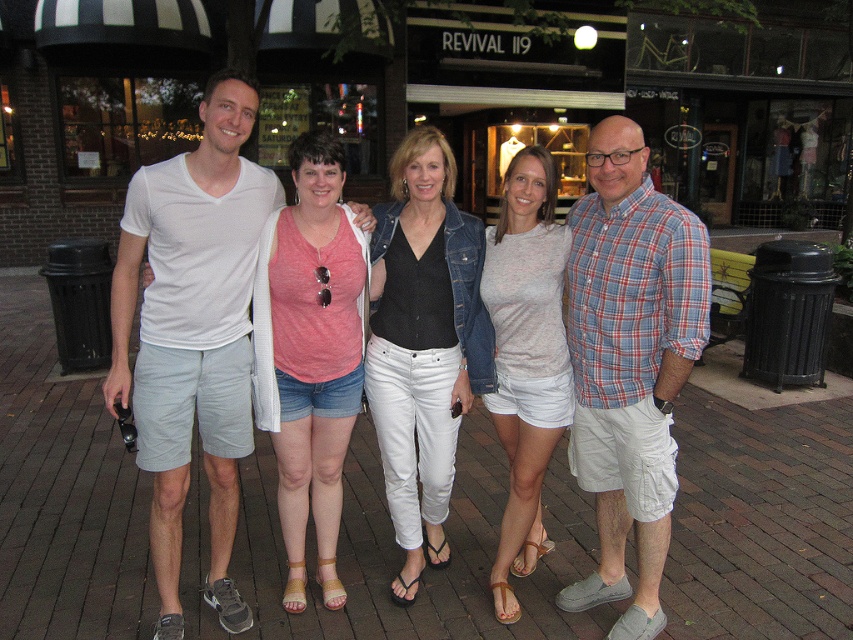
Can you confirm if white cotton shorts at center is shorter than pink fabric tank top at center?

No, white cotton shorts at center is not shorter than pink fabric tank top at center.

The height and width of the screenshot is (640, 853). I want to click on white cotton shorts at center, so click(x=434, y=266).

Does point (270, 204) come in front of point (454, 348)?

Yes, point (270, 204) is in front of point (454, 348).

Between point (190, 346) and point (227, 72), which one is positioned behind?

Positioned behind is point (190, 346).

Where is `white mesh t-shirt at left`? white mesh t-shirt at left is located at coordinates (193, 332).

Which is below, plaid cotton shirt at right or light pink jersey at center?

light pink jersey at center is below.

Is plaid cotton shirt at right shorter than light pink jersey at center?

Incorrect, plaid cotton shirt at right's height does not fall short of light pink jersey at center's.

Does point (654, 200) come farther from viewer compared to point (537, 548)?

No, it is not.

Locate an element on the screen. Image resolution: width=853 pixels, height=640 pixels. plaid cotton shirt at right is located at coordinates (630, 362).